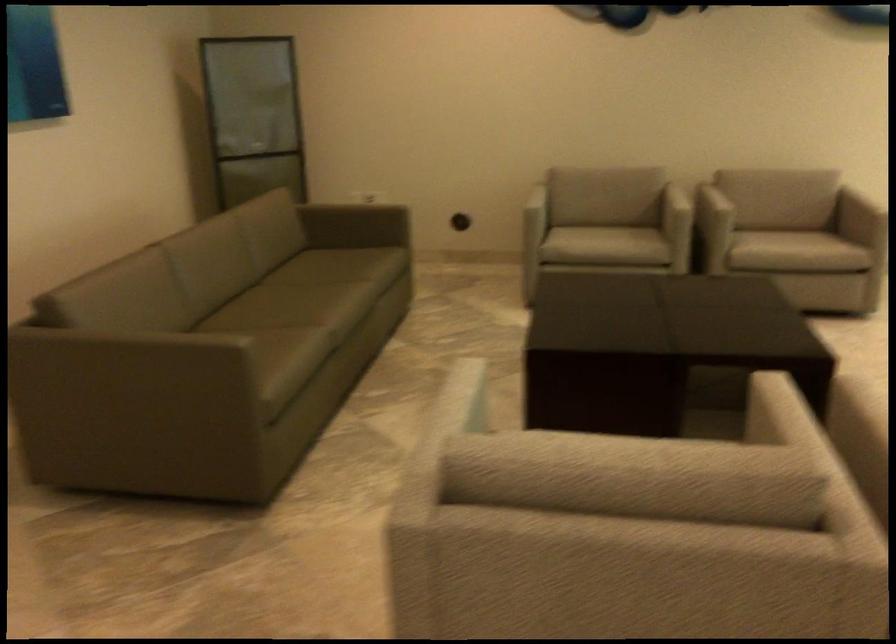
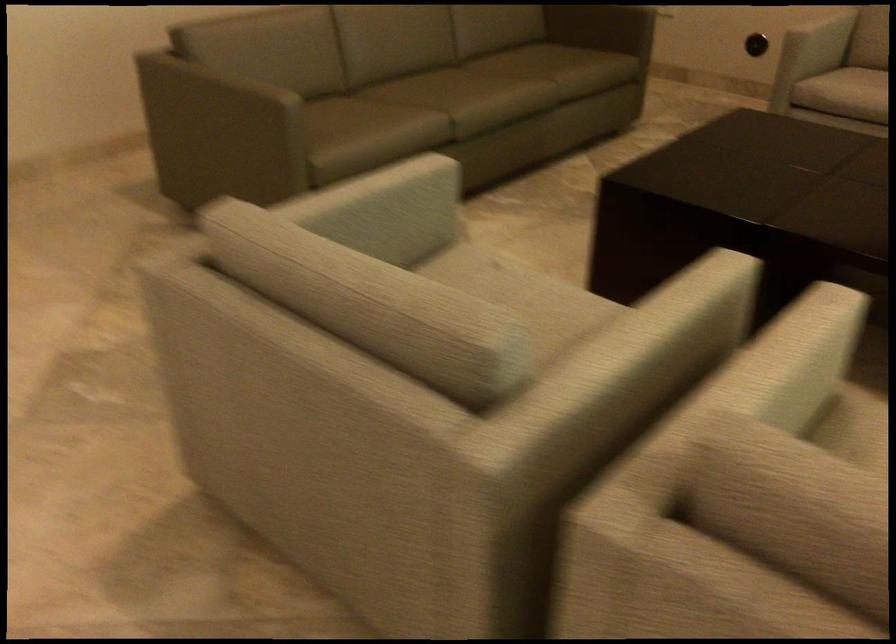
In the second image, find the point that corresponds to the point at 805,433 in the first image.

(659, 332)